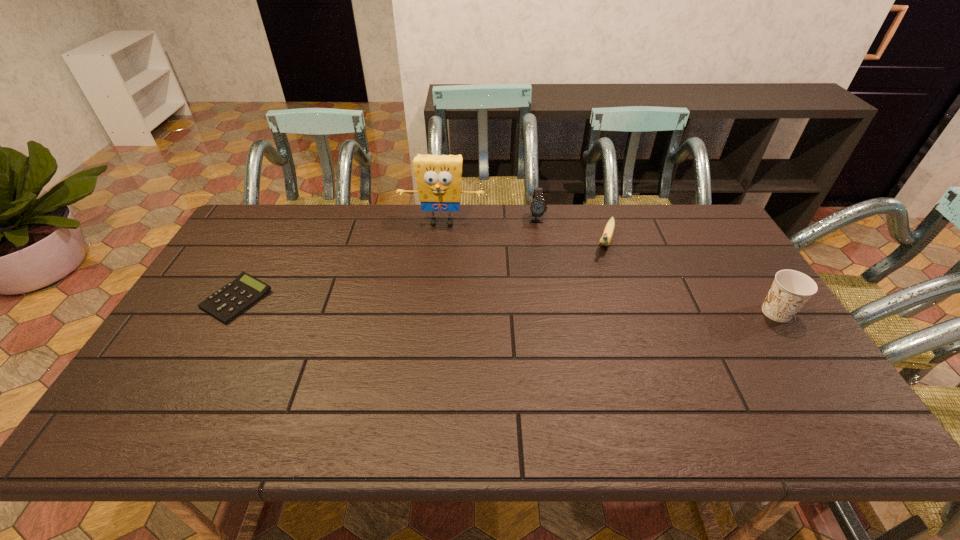
The height and width of the screenshot is (540, 960). Identify the location of sponge that is at the far edge. (438, 178).

The height and width of the screenshot is (540, 960). I want to click on watch present at the far edge, so click(x=538, y=207).

Where is `object that is positioned at the left edge`? This screenshot has height=540, width=960. object that is positioned at the left edge is located at coordinates (227, 303).

Image resolution: width=960 pixels, height=540 pixels. Identify the location of object that is at the right edge. (791, 289).

Where is `free region at the far edge`? The width and height of the screenshot is (960, 540). free region at the far edge is located at coordinates (602, 233).

I want to click on blank area at the near edge, so click(708, 387).

Find the location of a particular element. vacant space at the far left corner of the desktop is located at coordinates (277, 213).

Image resolution: width=960 pixels, height=540 pixels. In order to click on vacant space at the far right corner in this screenshot , I will do `click(720, 231)`.

Locate an element on the screen. empty space between the watch and the sponge is located at coordinates (489, 221).

Identify the location of empty location between the second object from left to right and the fourth tallest object. (524, 232).